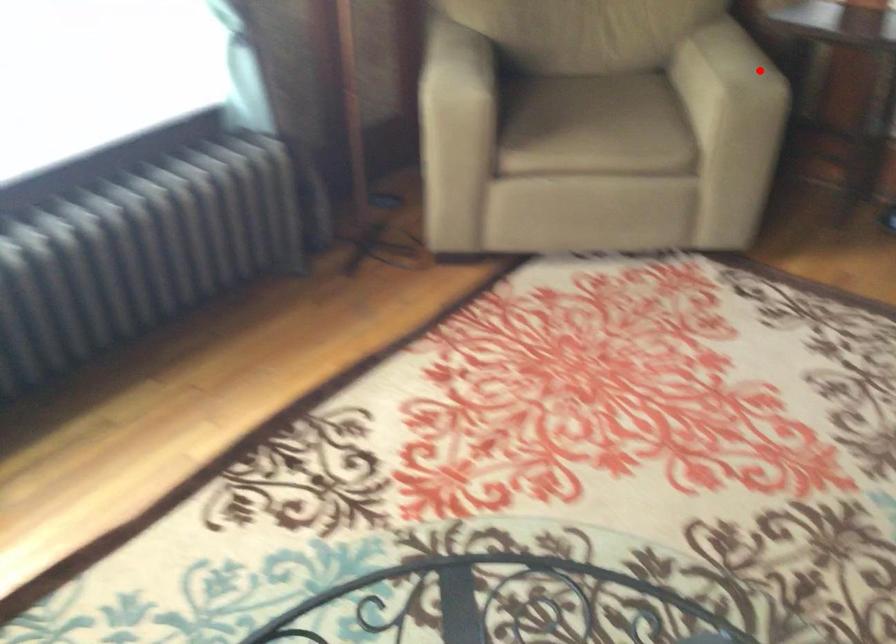
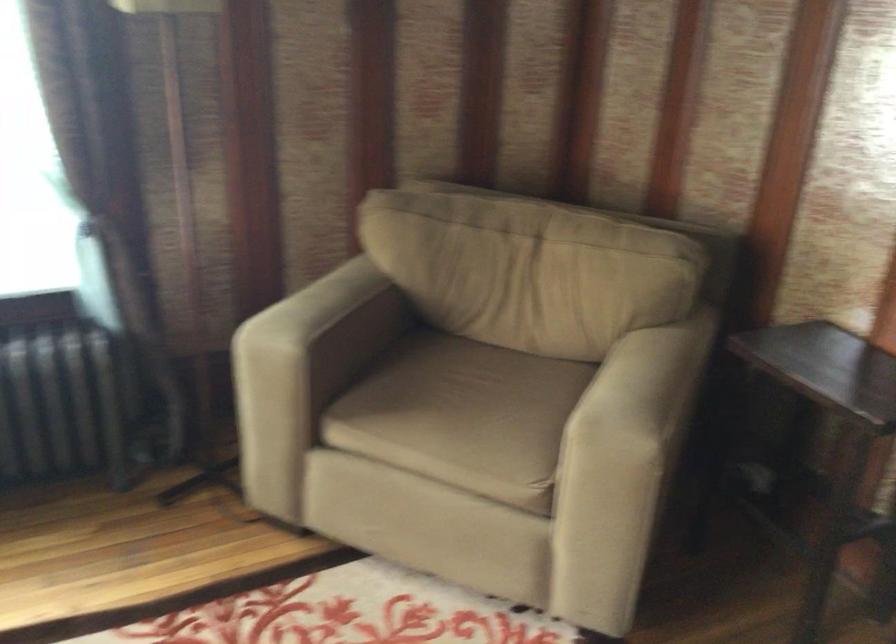
Question: I am providing you with two images of the same scene from different viewpoints. Image1 has a red point marked. In image2, the corresponding 3D location appears at what relative position? Reply with the corresponding letter.

Choices:
 (A) Closer
 (B) Farther

Answer: (A)